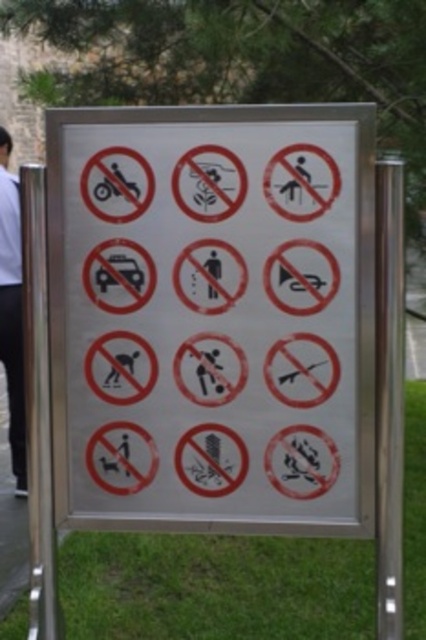
You are looking at the signboard and notice two points marked on it. The first point is at coordinates (333, 232) and the second point is at (17, 362). Which of these points appears closer to you on the signboard?

Point (333, 232) is closer to the camera than point (17, 362), so the first point appears closer to you.